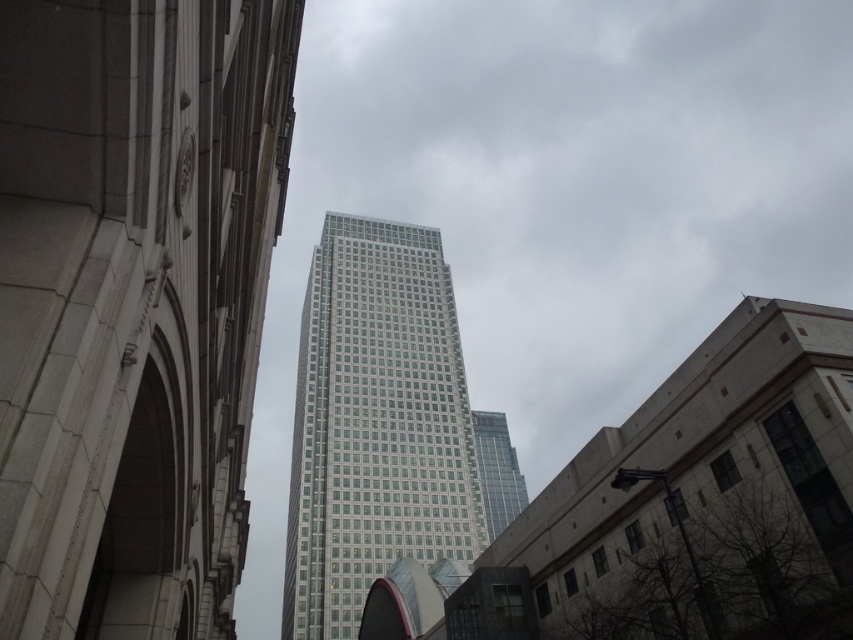
You are an architect analyzing the urban skyline. You observe the white glass tower at center and the clear glass skyscraper at center. Which of these two structures is taller?

The white glass tower at center is taller than the clear glass skyscraper at center according to the description.

You are standing in the city square and see both the white glass tower at center and the clear glass skyscraper at center. Which one would appear larger to you?

The white glass tower at center appears larger because it is closer to the viewer than the clear glass skyscraper at center.